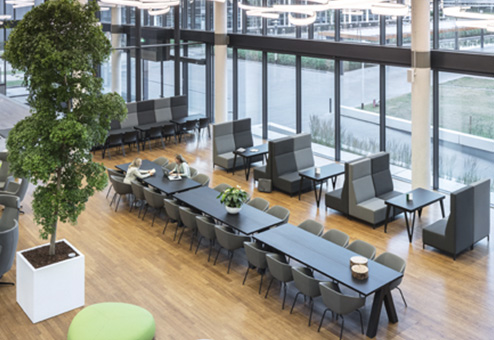
Find the location of a particular element. This screenshot has width=494, height=340. benches is located at coordinates (446, 225), (370, 207), (335, 196), (289, 178), (260, 171), (224, 151), (171, 111), (137, 116).